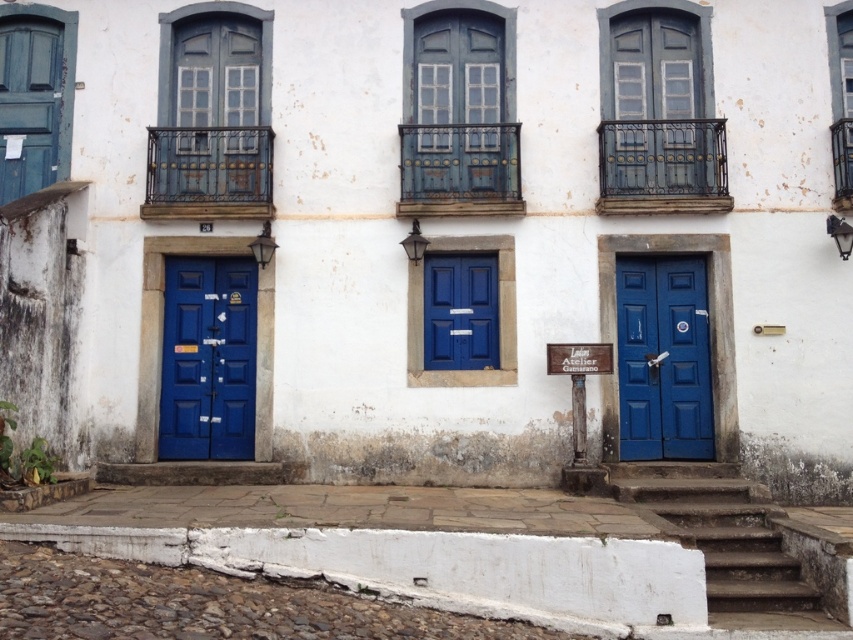
Where is `matte blue door at right`? matte blue door at right is located at coordinates (663, 358).

Does matte blue door at right appear over matte blue shutter at upper left?

No, matte blue door at right is not above matte blue shutter at upper left.

Does point (624, 346) come farther from viewer compared to point (44, 28)?

No.

Where is `matte blue door at right`? This screenshot has width=853, height=640. matte blue door at right is located at coordinates (663, 358).

Can you confirm if matte blue door at right is wider than white stone stairs at lower center?

Incorrect, matte blue door at right's width does not surpass white stone stairs at lower center's.

Is matte blue door at right thinner than white stone stairs at lower center?

Correct, matte blue door at right's width is less than white stone stairs at lower center's.

Is point (672, 314) positioned in front of point (709, 504)?

No, (672, 314) is behind (709, 504).

The height and width of the screenshot is (640, 853). I want to click on matte blue door at right, so click(663, 358).

Is matte blue door at right shorter than matte blue door at center?

Incorrect, matte blue door at right's height does not fall short of matte blue door at center's.

Does matte blue door at right have a greater height compared to matte blue door at center?

Yes, matte blue door at right is taller than matte blue door at center.

Is point (677, 371) closer to camera compared to point (431, 320)?

Yes, point (677, 371) is closer to viewer.

Identify the location of matte blue door at right. (x=663, y=358).